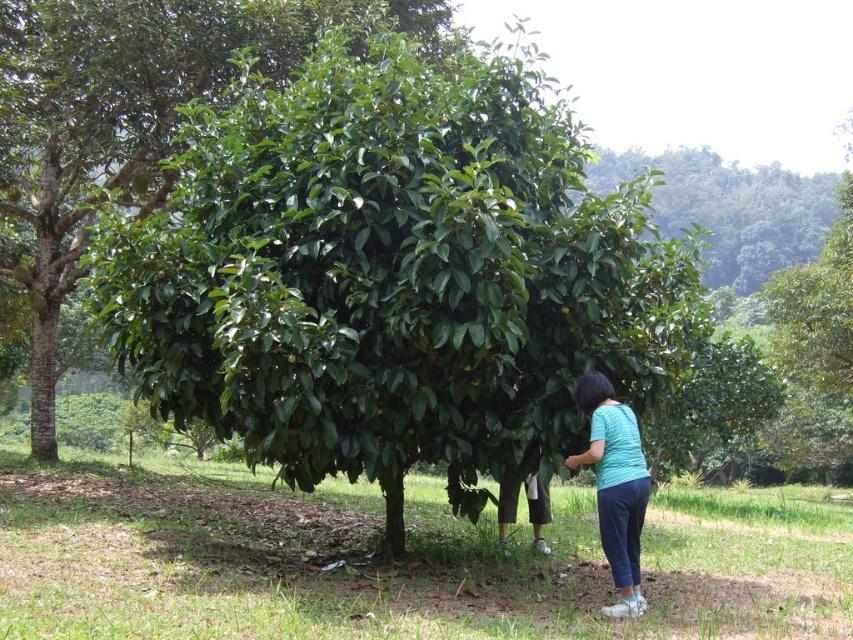
Question: Which of the following is the farthest from the observer?

Choices:
 (A) green glossy tree at center
 (B) teal fabric shirt at center

Answer: (A)

Question: Is teal fabric shirt at center bigger than dark blue cotton pants at lower center?

Choices:
 (A) no
 (B) yes

Answer: (B)

Question: Does green glossy leaves at center have a smaller size compared to dark blue cotton pants at lower center?

Choices:
 (A) yes
 (B) no

Answer: (A)

Question: Which object is the closest to the green glossy leaves at center?

Choices:
 (A) green glossy tree at center
 (B) teal fabric shirt at center

Answer: (B)

Question: Considering the real-world distances, which object is farthest from the green glossy leaves at center?

Choices:
 (A) green glossy tree at center
 (B) dark blue cotton pants at lower center

Answer: (A)

Question: Can you confirm if green glossy leaves at center is thinner than green glossy tree at center?

Choices:
 (A) yes
 (B) no

Answer: (A)